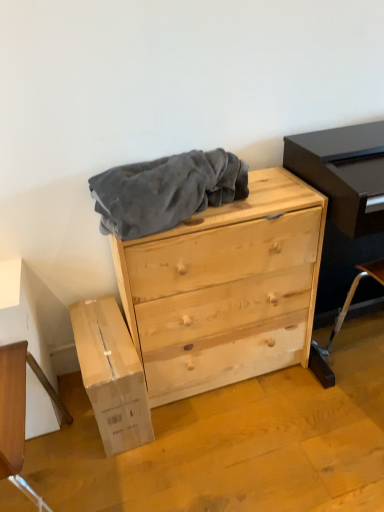
Locate an element on the screen. free space between natural wood chest of drawers at center and matte black entertainment center at right is located at coordinates (292, 394).